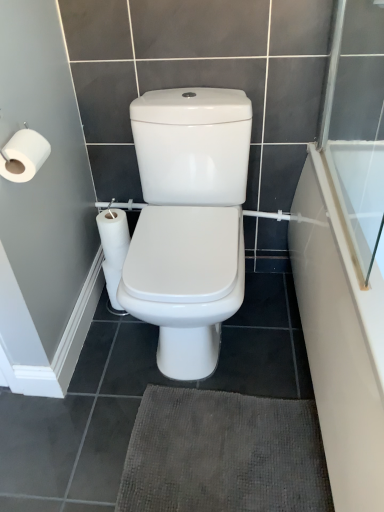
Where is `free space underneath transparent glass screen door at upper right (from a real-world perspective)`? This screenshot has width=384, height=512. free space underneath transparent glass screen door at upper right (from a real-world perspective) is located at coordinates click(x=335, y=203).